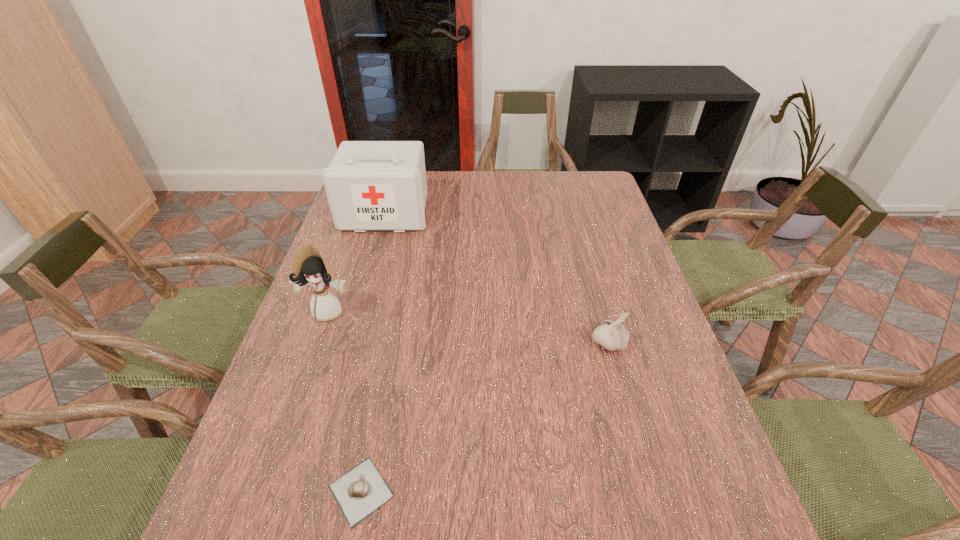
Identify the location of vacant region between the shortest object and the farther garlic. This screenshot has width=960, height=540. (485, 417).

Select which object is the second closest to the shortest object. Please provide its 2D coordinates. Your answer should be formatted as a tuple, i.e. [(x, y)], where the tuple contains the x and y coordinates of a point satisfying the conditions above.

[(612, 335)]

This screenshot has width=960, height=540. Identify the location of the second closest object to the shorter garlic. (612, 335).

Image resolution: width=960 pixels, height=540 pixels. I want to click on vacant space that satisfies the following two spatial constraints: 1. on the front-facing side of the farthest object; 2. on the left side of the second shortest object, so click(348, 343).

Where is `vacant space that satisfies the following two spatial constraints: 1. on the front-facing side of the nearer garlic; 2. on the left side of the farthest object`? This screenshot has height=540, width=960. vacant space that satisfies the following two spatial constraints: 1. on the front-facing side of the nearer garlic; 2. on the left side of the farthest object is located at coordinates (307, 491).

Locate an element on the screen. blank area in the image that satisfies the following two spatial constraints: 1. on the front-facing side of the left garlic; 2. on the right side of the farthest object is located at coordinates point(307,491).

Find the location of a particular element. The height and width of the screenshot is (540, 960). vacant space that satisfies the following two spatial constraints: 1. at the front face of the second farthest object; 2. on the left side of the nearest object is located at coordinates (265, 491).

Identify the location of free space that satisfies the following two spatial constraints: 1. on the front-facing side of the second shortest object; 2. on the left side of the tallest object. (348, 343).

Where is `free space in the image that satisfies the following two spatial constraints: 1. at the front face of the doll; 2. on the left side of the third tallest object`? free space in the image that satisfies the following two spatial constraints: 1. at the front face of the doll; 2. on the left side of the third tallest object is located at coordinates (317, 343).

Where is `vacant space that satisfies the following two spatial constraints: 1. on the front-facing side of the first-aid kit; 2. on the left side of the nearer garlic`? Image resolution: width=960 pixels, height=540 pixels. vacant space that satisfies the following two spatial constraints: 1. on the front-facing side of the first-aid kit; 2. on the left side of the nearer garlic is located at coordinates (307, 491).